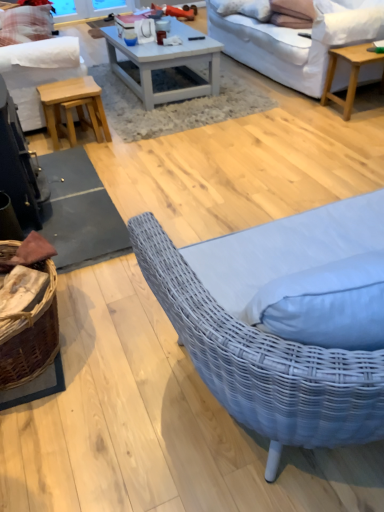
Question: Is white fabric studio couch at upper right, which is counted as the 2th studio couch, starting from the left, wider or thinner than light brown wooden stool at left?

Choices:
 (A) wide
 (B) thin

Answer: (A)

Question: Is point (311, 66) closer or farther from the camera than point (76, 95)?

Choices:
 (A) farther
 (B) closer

Answer: (A)

Question: Which of these objects is positioned closest to the white fabric studio couch at left, placed as the 2th studio couch when sorted from right to left?

Choices:
 (A) white painted wood coffee table at center, the first coffee table in the left-to-right sequence
 (B) white textured pillow at upper center, the second pillow from the front
 (C) light brown wooden stool at left
 (D) plaid fabric pillow at upper left, which ranks as the first pillow in back-to-front order
 (E) suede-like beige pillow at upper right, marked as the third pillow in a left-to-right arrangement

Answer: (C)

Question: Which object is positioned farthest from the plaid fabric pillow at upper left, which ranks as the third pillow in front-to-back order?

Choices:
 (A) white fabric studio couch at left, placed as the 2th studio couch when sorted from right to left
 (B) white fabric studio couch at upper right, the 1th studio couch when ordered from right to left
 (C) light wood/texture coffee table at upper right, which is the first coffee table in right-to-left order
 (D) white textured pillow at upper center, the second pillow positioned from the right
 (E) white painted wood coffee table at center, the 2th coffee table positioned from the right

Answer: (C)